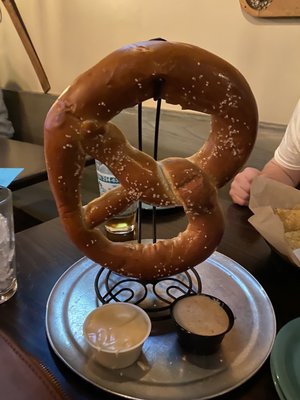
I want to click on holder, so click(166, 293).